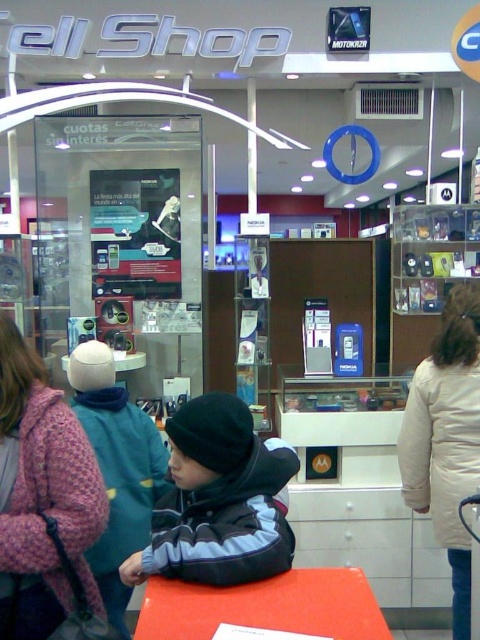
You are a customer in the store and want to pick up both the knitted pink sweater at left and the gray fleece jacket at center. Which item should you walk towards first if you are currently standing to the right of both items?

You should walk towards the knitted pink sweater at left first because it is positioned to the left of the gray fleece jacket at center, so it will be closer to you when approaching from the right side of both items.

You are a customer in the store and want to see the gray fleece jacket at center. Can you see the smooth orange table at center from where the jacket is placed?

The gray fleece jacket at center is taller than the smooth orange table at center, so the jacket may block the view of the smooth orange table at center.

Looking at this image, you are a customer in the store and want to place a small phone accessory on the gray fleece jacket at center and the smooth orange table at center. Which surface would allow the accessory to be more visible to other customers?

The smooth orange table at center is thicker than the gray fleece jacket at center, so placing the accessory on the smooth orange table at center would make it more visible.